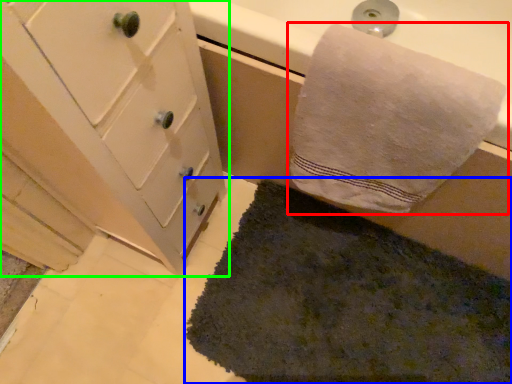
Question: Based on their relative distances, which object is nearer to towel (highlighted by a red box)? Choose from bath mat (highlighted by a blue box) and bathroom cabinet (highlighted by a green box).

Choices:
 (A) bath mat
 (B) bathroom cabinet

Answer: (B)